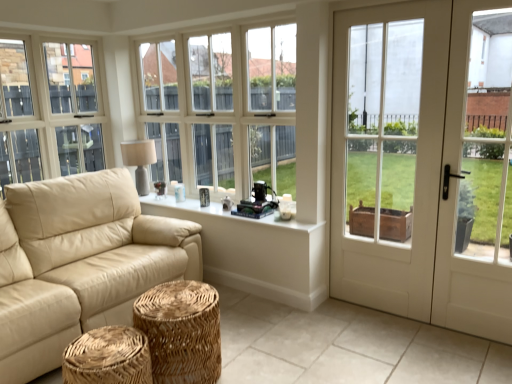
The image size is (512, 384). Identify the location of vacant area that is in front of white glass door at right. (481, 360).